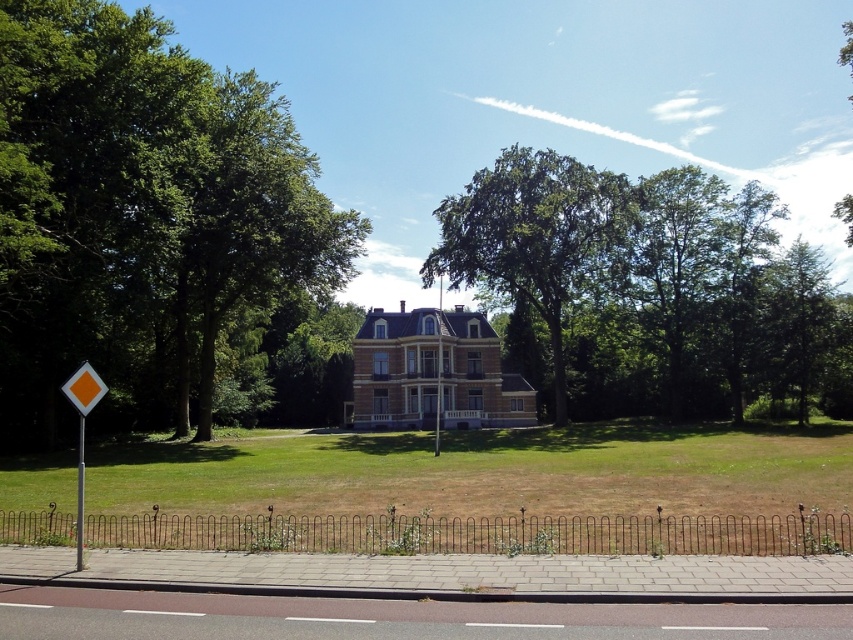
Question: Among these objects, which one is nearest to the camera?

Choices:
 (A) green leafy tree at center
 (B) green leafy tree at left
 (C) yellow plastic diamond at left

Answer: (C)

Question: Does green leafy tree at left appear on the right side of green leafy tree at center?

Choices:
 (A) no
 (B) yes

Answer: (A)

Question: Does green leafy tree at center have a larger size compared to yellow plastic diamond at left?

Choices:
 (A) yes
 (B) no

Answer: (A)

Question: Which is farther from the yellow plastic diamond at left?

Choices:
 (A) green leafy tree at center
 (B) orange plastic diamond at left
 (C) green leafy tree at left

Answer: (A)

Question: Can you confirm if green leafy tree at center is thinner than yellow plastic diamond at left?

Choices:
 (A) yes
 (B) no

Answer: (B)

Question: Based on their relative distances, which object is farther from the yellow plastic diamond at left?

Choices:
 (A) green leafy tree at center
 (B) orange plastic diamond at left
 (C) green leafy tree at left

Answer: (A)